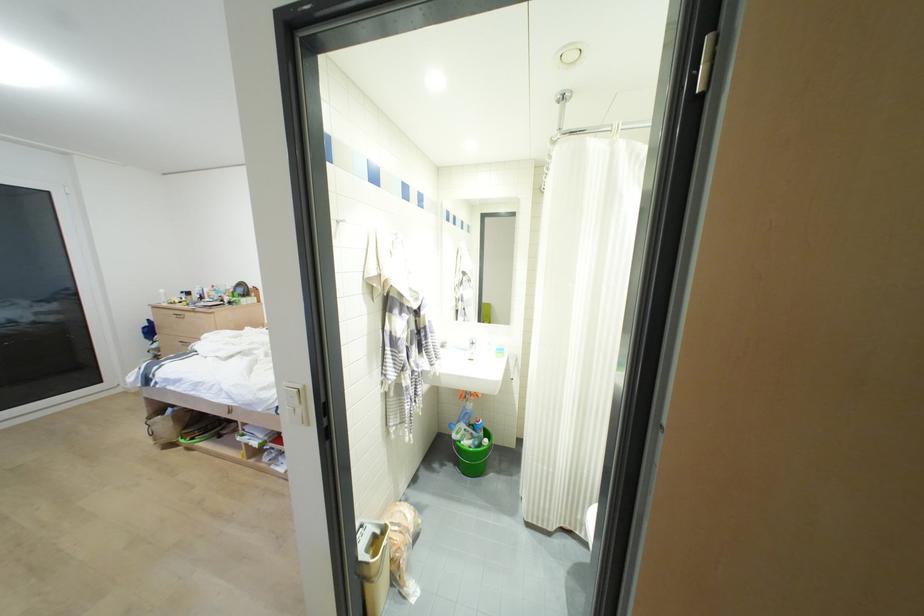
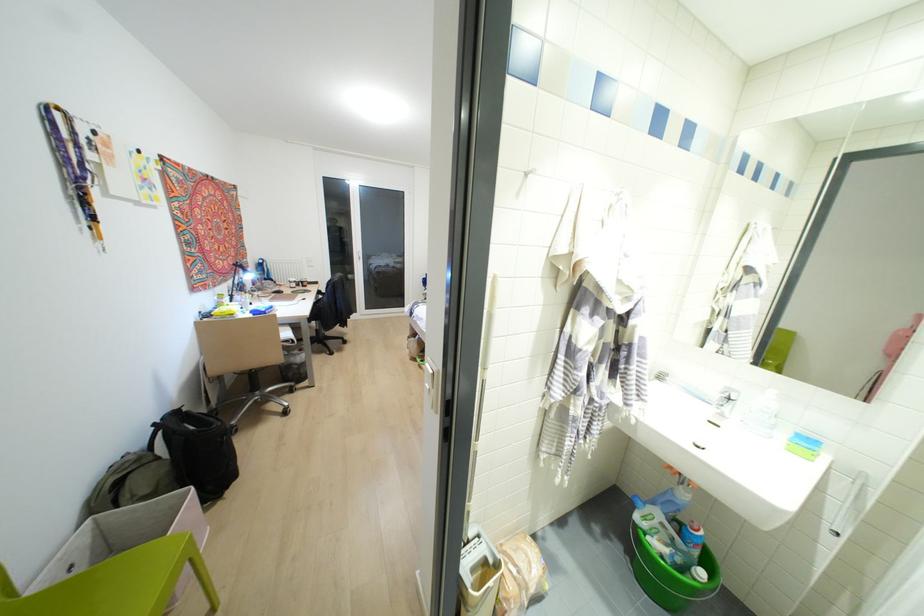
Question: Based on the continuous images, in which direction is the camera rotating? Reply with the corresponding letter.

Choices:
 (A) Left
 (B) Right
 (C) Up
 (D) Down

Answer: (A)